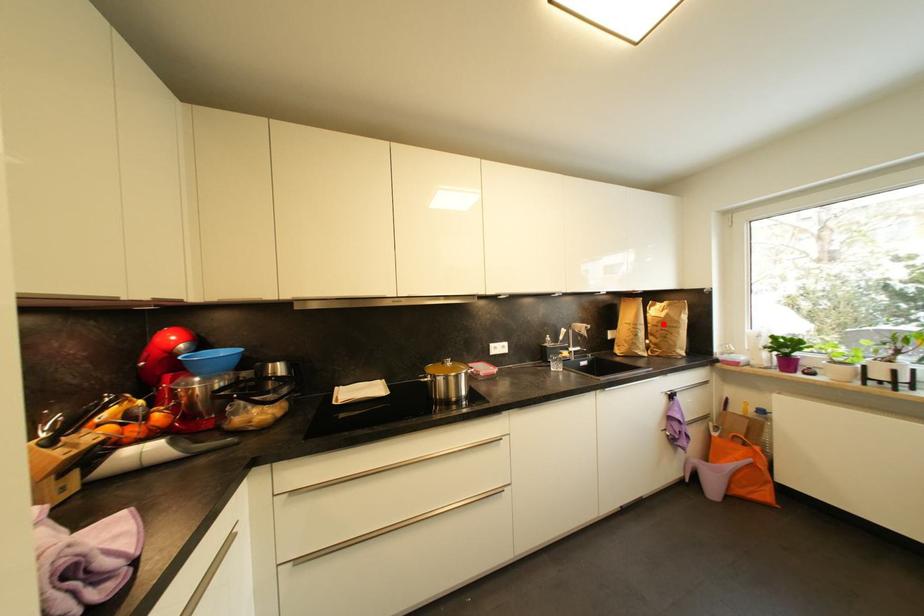
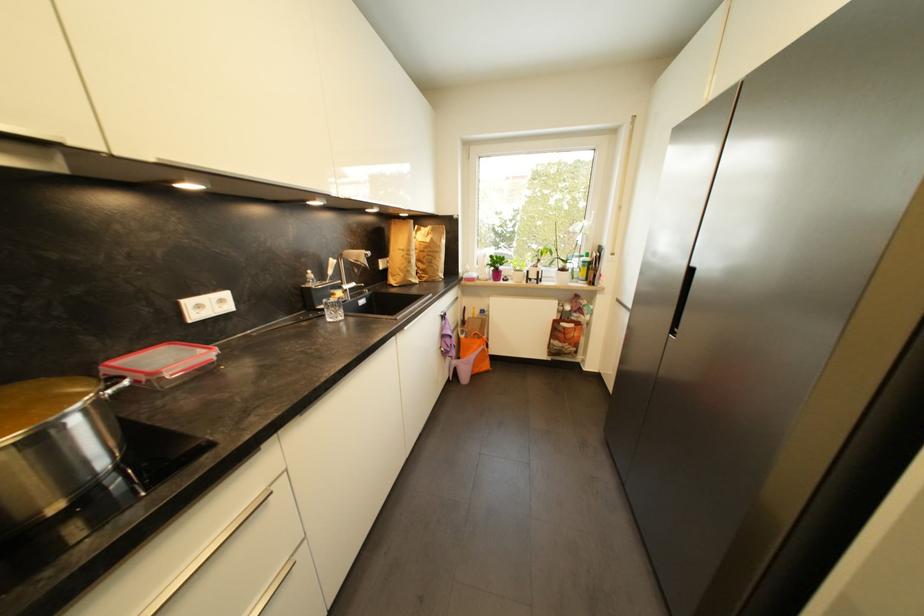
The point at the highlighted location is marked in the first image. Where is the corresponding point in the second image?

(430, 249)